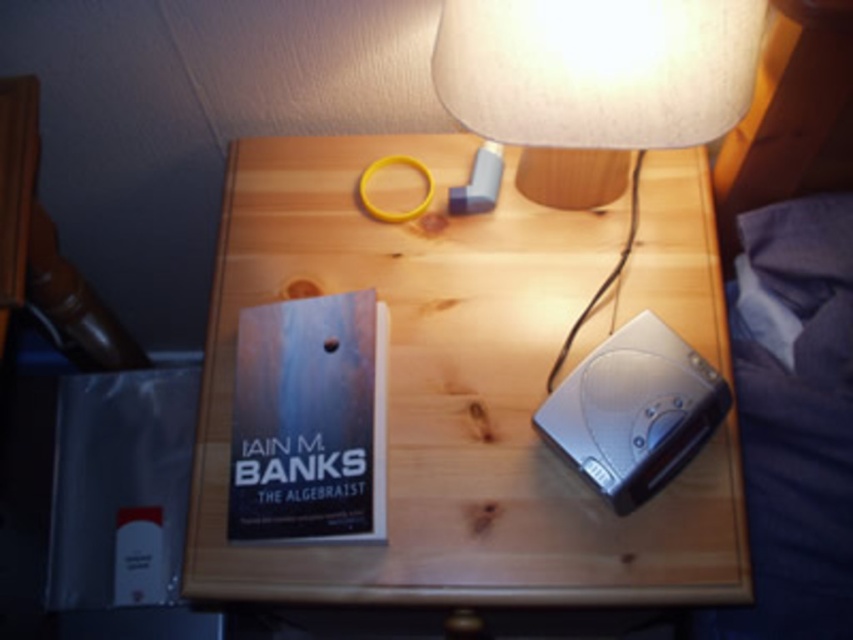
Question: From the image, what is the correct spatial relationship of matte beige lampshade at upper center in relation to hardcover book at center?

Choices:
 (A) above
 (B) below

Answer: (A)

Question: Which point is farther to the camera?

Choices:
 (A) (368, 314)
 (B) (328, 595)

Answer: (A)

Question: Which point is farther from the camera taking this photo?

Choices:
 (A) (606, 113)
 (B) (598, 532)
 (C) (296, 433)

Answer: (C)

Question: Does wooden table at center appear on the right side of matte beige lampshade at upper center?

Choices:
 (A) no
 (B) yes

Answer: (A)

Question: Does matte beige lampshade at upper center come in front of hardcover book at center?

Choices:
 (A) no
 (B) yes

Answer: (B)

Question: Which object is farther from the camera taking this photo?

Choices:
 (A) matte beige lampshade at upper center
 (B) hardcover book at center

Answer: (B)